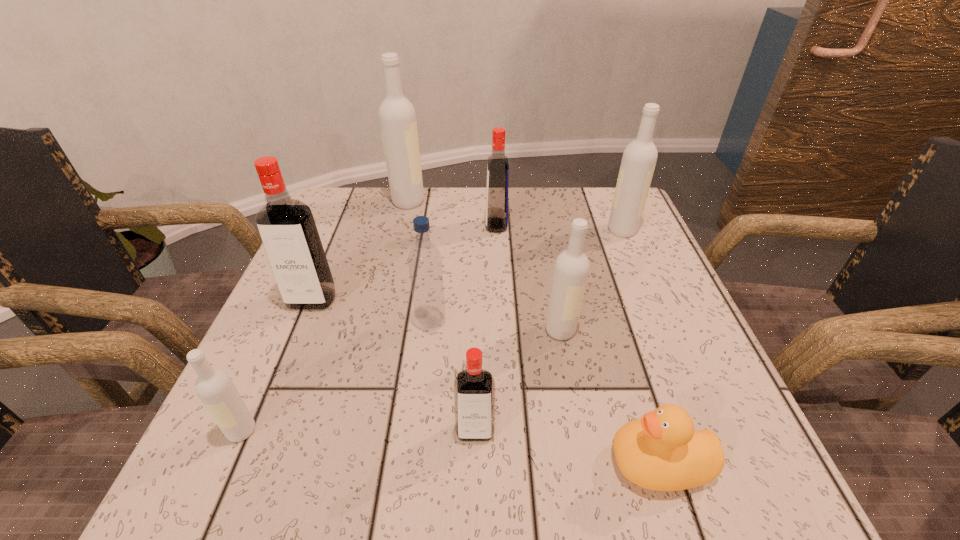
This screenshot has height=540, width=960. What are the coordinates of `duck located in the right edge section of the desktop` in the screenshot? It's located at (661, 451).

The height and width of the screenshot is (540, 960). I want to click on object present at the near left corner, so click(x=214, y=387).

Where is `object located in the far right corner section of the desktop`? Image resolution: width=960 pixels, height=540 pixels. object located in the far right corner section of the desktop is located at coordinates (639, 159).

You are a GUI agent. You are given a task and a screenshot of the screen. Output one action in this format:
    pyautogui.click(x=<x>, y=<y>)
    Task: Click on the object positioned at the near right corner
    This screenshot has width=960, height=540.
    Given the screenshot: What is the action you would take?
    pyautogui.click(x=661, y=451)

At what (x,y) coordinates should I click in order to perform the action: click on free space at the far edge. Please return your answer as a coordinate pair (x, y). The width and height of the screenshot is (960, 540). Looking at the image, I should click on (412, 218).

Identify the location of blank space at the near edge of the desktop. The height and width of the screenshot is (540, 960). coord(610,439).

In the image, there is a desktop. At what (x,y) coordinates should I click in order to perform the action: click on free region at the left edge. Please return your answer as a coordinate pair (x, y). The width and height of the screenshot is (960, 540). Looking at the image, I should click on (335, 283).

Image resolution: width=960 pixels, height=540 pixels. I want to click on vacant space at the right edge of the desktop, so click(593, 256).

Find the location of a particular element. The width and height of the screenshot is (960, 540). free space at the far left corner of the desktop is located at coordinates (326, 218).

The image size is (960, 540). In the image, there is a desktop. What are the coordinates of `vacant space at the near left corner` in the screenshot? It's located at (x=223, y=465).